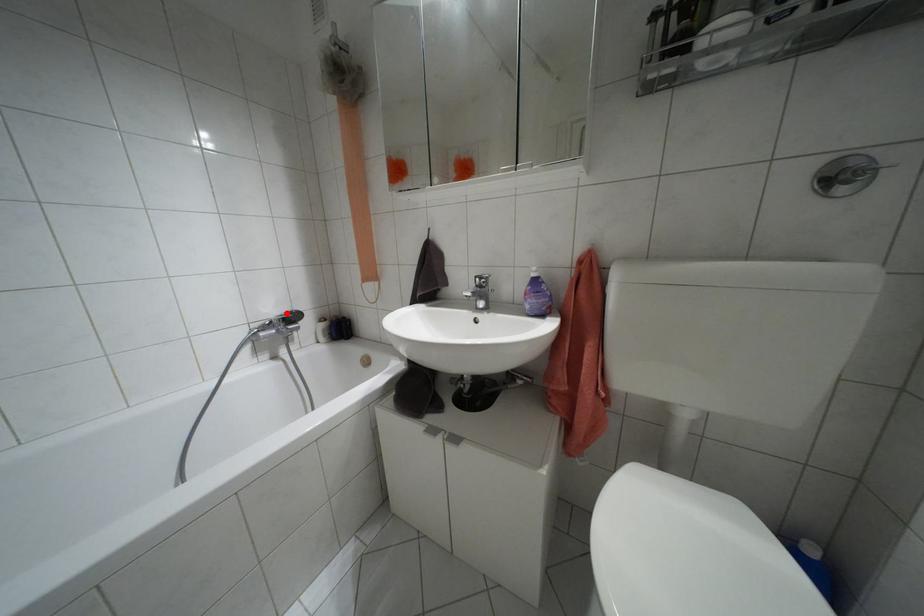
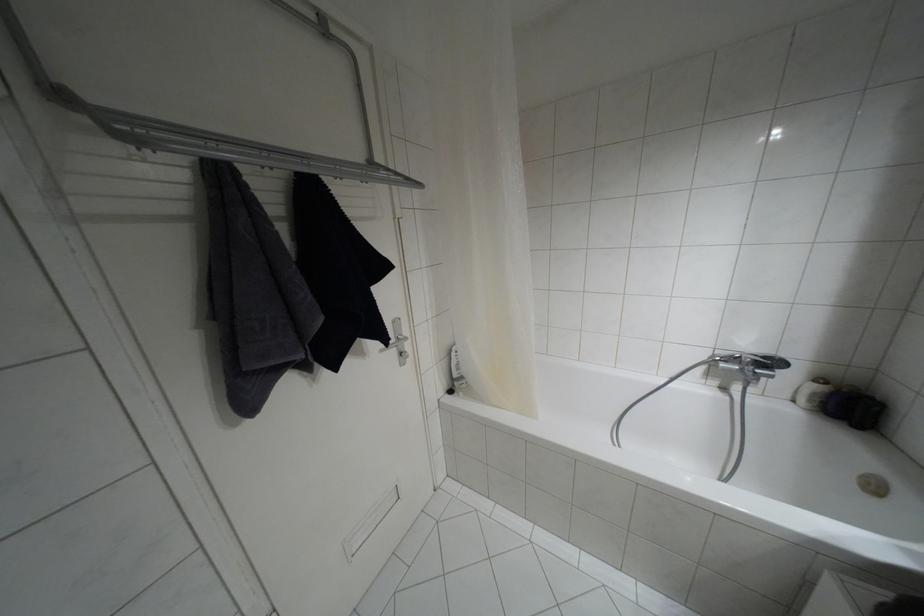
Question: I am providing you with two images of the same scene from different viewpoints. Given a red point in image1, look at the same physical point in image2. Is it:

Choices:
 (A) Closer to the viewpoint
 (B) Farther from the viewpoint

Answer: (B)